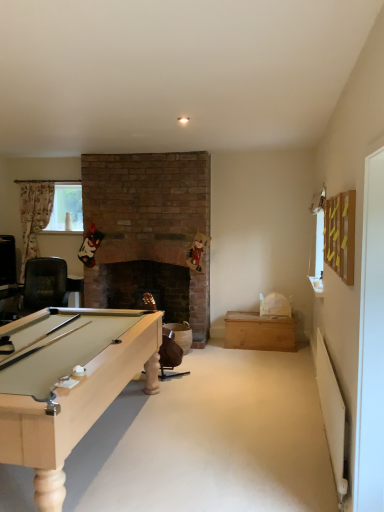
Question: Is clear plastic window screen at left located within light brown wood chest at center-right?

Choices:
 (A) no
 (B) yes

Answer: (A)

Question: From the image's perspective, is light brown wood chest at center-right on clear plastic window screen at left?

Choices:
 (A) no
 (B) yes

Answer: (A)

Question: Is light brown wood chest at center-right thinner than clear plastic window screen at left?

Choices:
 (A) no
 (B) yes

Answer: (A)

Question: Is light brown wood chest at center-right to the right of clear plastic window screen at left from the viewer's perspective?

Choices:
 (A) yes
 (B) no

Answer: (A)

Question: Is clear plastic window screen at left at the back of light brown wood chest at center-right?

Choices:
 (A) no
 (B) yes

Answer: (A)

Question: Is light brown wood chest at center-right aimed at clear plastic window screen at left?

Choices:
 (A) yes
 (B) no

Answer: (B)

Question: Is clear plastic window screen at left smaller than light brown wood chest at center-right?

Choices:
 (A) yes
 (B) no

Answer: (A)

Question: Does clear plastic window screen at left touch light brown wood chest at center-right?

Choices:
 (A) no
 (B) yes

Answer: (A)

Question: Is clear plastic window screen at left wider than light brown wood chest at center-right?

Choices:
 (A) yes
 (B) no

Answer: (B)

Question: From a real-world perspective, is clear plastic window screen at left below light brown wood chest at center-right?

Choices:
 (A) yes
 (B) no

Answer: (B)

Question: Does clear plastic window screen at left have a larger size compared to light brown wood chest at center-right?

Choices:
 (A) yes
 (B) no

Answer: (B)

Question: Does clear plastic window screen at left appear on the left side of light brown wood chest at center-right?

Choices:
 (A) no
 (B) yes

Answer: (B)

Question: Looking at the image, does clear plastic window screen at left seem bigger or smaller compared to light brown wood chest at center-right?

Choices:
 (A) big
 (B) small

Answer: (B)